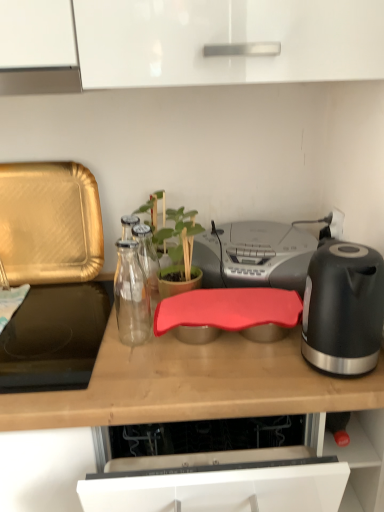
I want to click on free point above black glass cooktop at left (from a real-world perspective), so click(x=44, y=323).